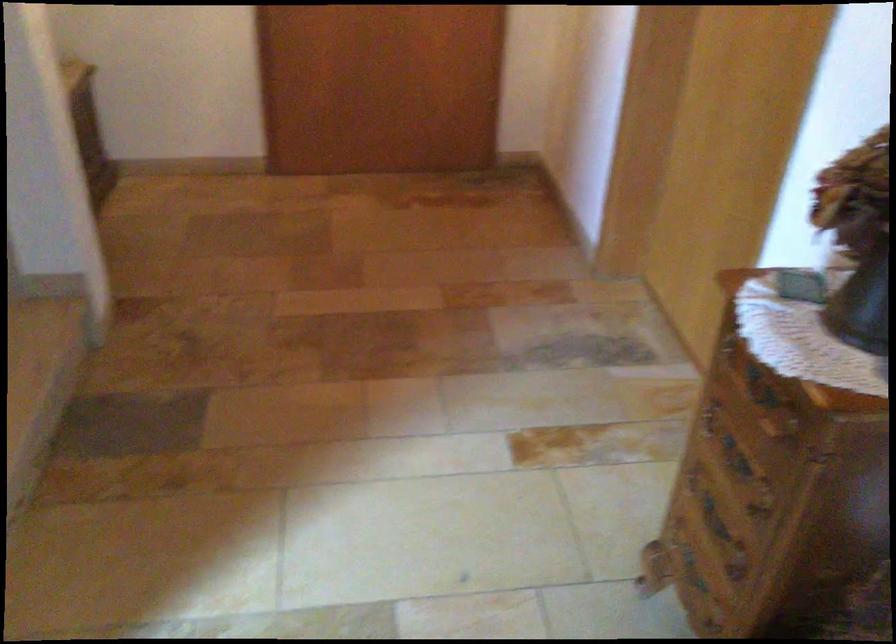
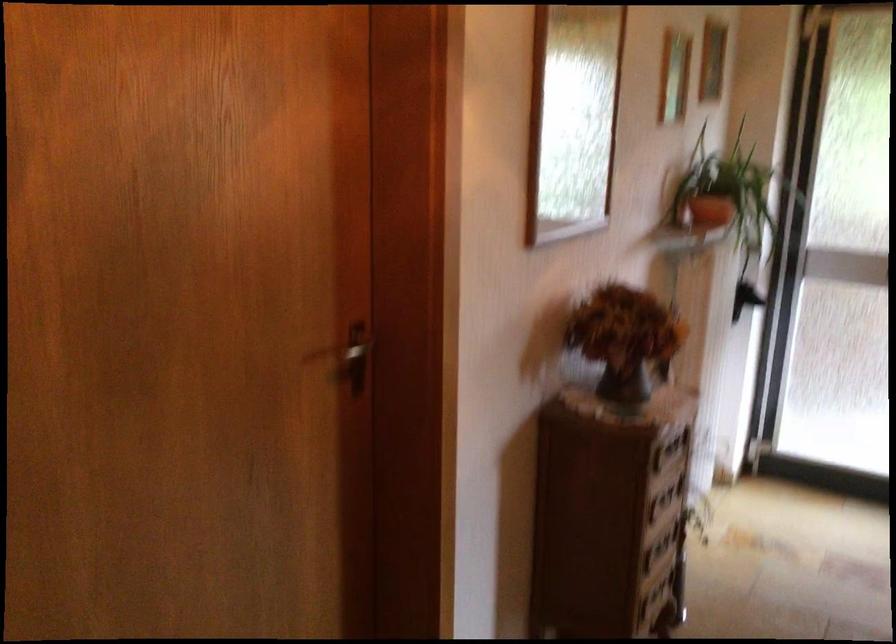
Where in the second image is the point corresponding to point (755, 460) from the first image?

(659, 504)